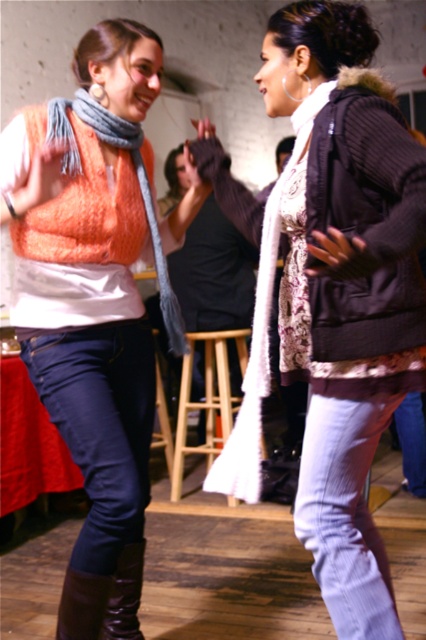
Does wooden stool at center appear on the right side of brown leather boot at lower left?

Yes, wooden stool at center is to the right of brown leather boot at lower left.

Is wooden stool at center positioned behind brown leather boot at lower left?

That is True.

In order to click on wooden stool at center in this screenshot , I will do `click(207, 397)`.

Is point (71, 390) positioned in front of point (37, 216)?

That is True.

This screenshot has width=426, height=640. What are the coordinates of `matte orange vest at center` in the screenshot? It's located at (94, 273).

Who is positioned more to the right, white textured scarf at center or knitted gray scarf at left?

From the viewer's perspective, white textured scarf at center appears more on the right side.

Which of these two, white textured scarf at center or knitted gray scarf at left, stands taller?

white textured scarf at center

The width and height of the screenshot is (426, 640). Describe the element at coordinates (331, 291) in the screenshot. I see `white textured scarf at center` at that location.

At what (x,y) coordinates should I click in order to perform the action: click on white textured scarf at center. Please return your answer as a coordinate pair (x, y). Looking at the image, I should click on (331, 291).